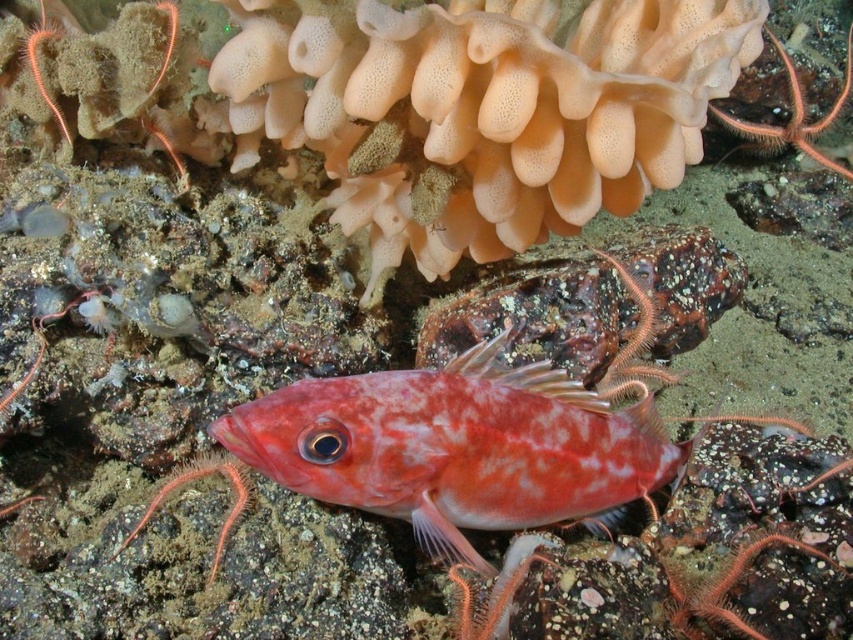
You are a marine biologist observing an underwater scene. You notice a shiny pink fish at center and a speckled rock at center. Which object is taller in this underwater environment?

The shiny pink fish at center is much taller than the speckled rock at center.